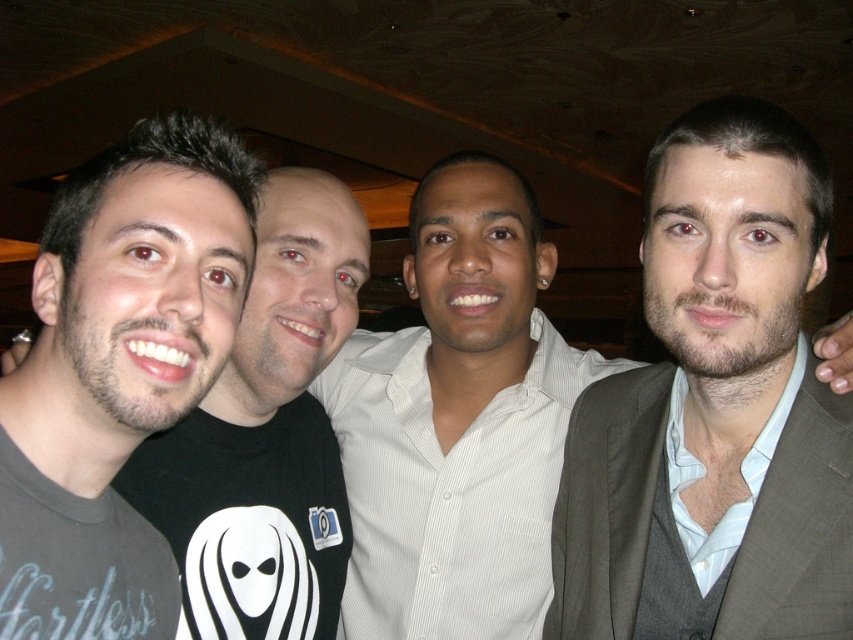
Is light brown suit at right bigger than gray matte t-shirt at left?

Correct, light brown suit at right is larger in size than gray matte t-shirt at left.

Can you confirm if light brown suit at right is positioned above gray matte t-shirt at left?

No.

Where is `light brown suit at right`? light brown suit at right is located at coordinates (714, 403).

Where is `light brown suit at right`? The width and height of the screenshot is (853, 640). light brown suit at right is located at coordinates (714, 403).